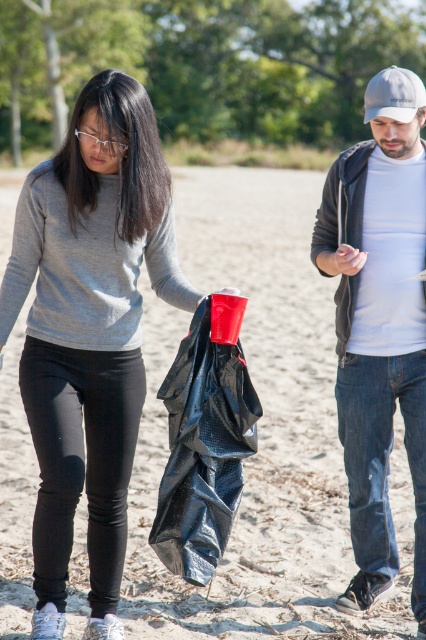
You are a photographer trying to capture a photo of both jackets in the scene. Since the matte black jacket at center is shorter than the denim jacket at right, how can you adjust your camera angle to ensure both jackets are fully visible in the frame?

To ensure both jackets are fully visible, position the camera slightly lower so the shorter matte black jacket at center isn

You are a photographer setting up a tripod to capture the scene. The tripod requires the tallest object in the immediate foreground to be at least 1.2 meters tall to serve as a stable base. Based on the objects listed, can the denim jacket at right and black matte bag at center meet this requirement?

The denim jacket at right has a greater height compared to black matte bag at center. However, since the minimum required height is 1.2 meters and we only know the denim jacket is taller than the bag, but not its exact height, it is uncertain if either object meets the tripod requirement.

You are standing at the origin point in the image and want to find the matte black jacket at center. Which direction should you move to locate it?

The matte black jacket at center is located at coordinates approximately 0.519 along the x axis and 0.211 along the y axis. Since the origin is at the bottom left corner, you should move to the right and slightly upward from your current position to reach it.